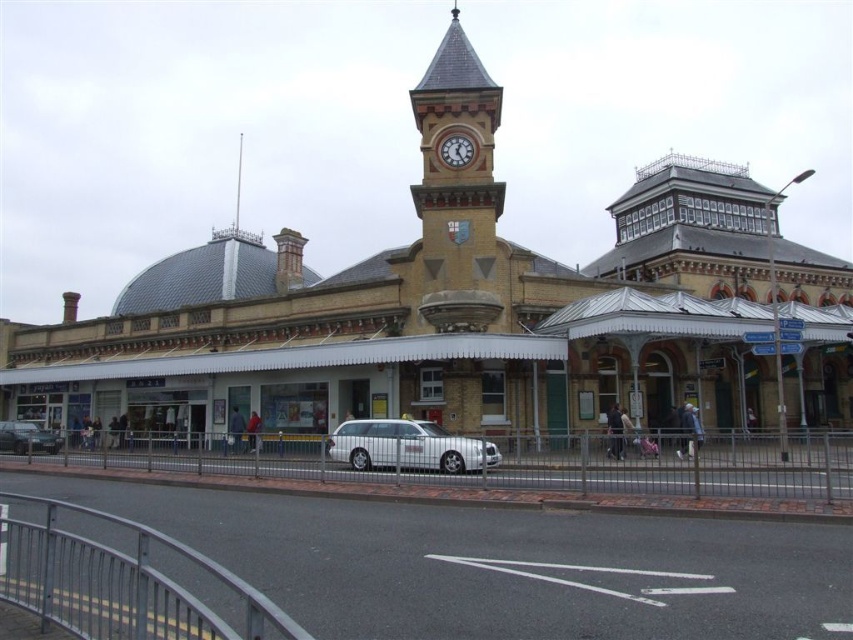
Is point (45, 444) closer to viewer compared to point (440, 148)?

No, (45, 444) is further to viewer.

Consider the image. Between metallic silver car at lower left and white painted metal clock at upper center, which one is positioned lower?

metallic silver car at lower left is below.

Is point (10, 428) farther from viewer compared to point (473, 140)?

Yes.

Locate an element on the screen. The image size is (853, 640). metallic silver car at lower left is located at coordinates (26, 438).

Is silver metallic station wagon at center above white painted metal clock at upper center?

Actually, silver metallic station wagon at center is below white painted metal clock at upper center.

Describe the element at coordinates (408, 445) in the screenshot. I see `silver metallic station wagon at center` at that location.

In order to click on silver metallic station wagon at center in this screenshot , I will do `click(408, 445)`.

Where is `silver metallic station wagon at center`? silver metallic station wagon at center is located at coordinates (408, 445).

Does silver metallic station wagon at center lie behind metallic silver car at lower left?

No.

Can you confirm if silver metallic station wagon at center is wider than metallic silver car at lower left?

Yes.

What do you see at coordinates (408, 445) in the screenshot? The height and width of the screenshot is (640, 853). I see `silver metallic station wagon at center` at bounding box center [408, 445].

Locate an element on the screen. silver metallic station wagon at center is located at coordinates (408, 445).